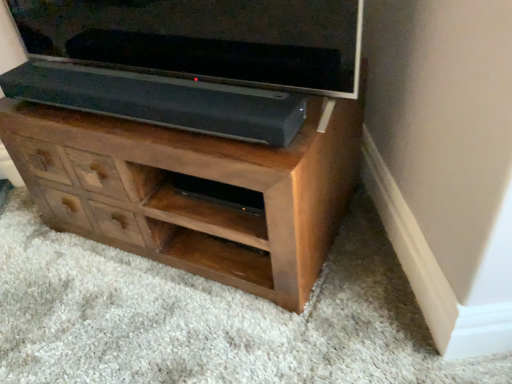
Describe the element at coordinates (193, 198) in the screenshot. I see `brown wood chest of drawers at center` at that location.

In order to face brown wood chest of drawers at center, should I rotate leftwards or rightwards?

It's best to rotate left around 8.552 degrees.

The image size is (512, 384). I want to click on brown wood chest of drawers at center, so click(x=193, y=198).

Where is `brown wood chest of drawers at center`? brown wood chest of drawers at center is located at coordinates (193, 198).